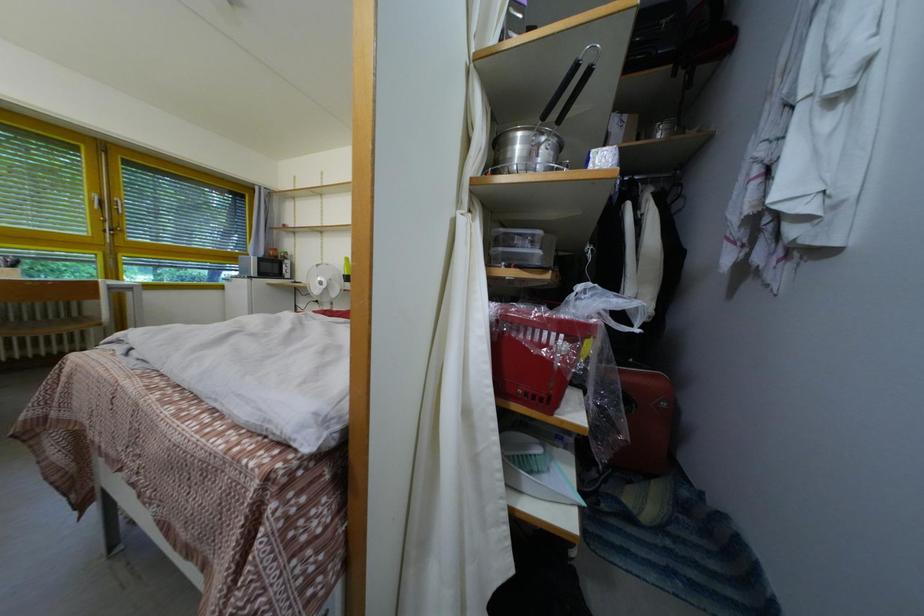
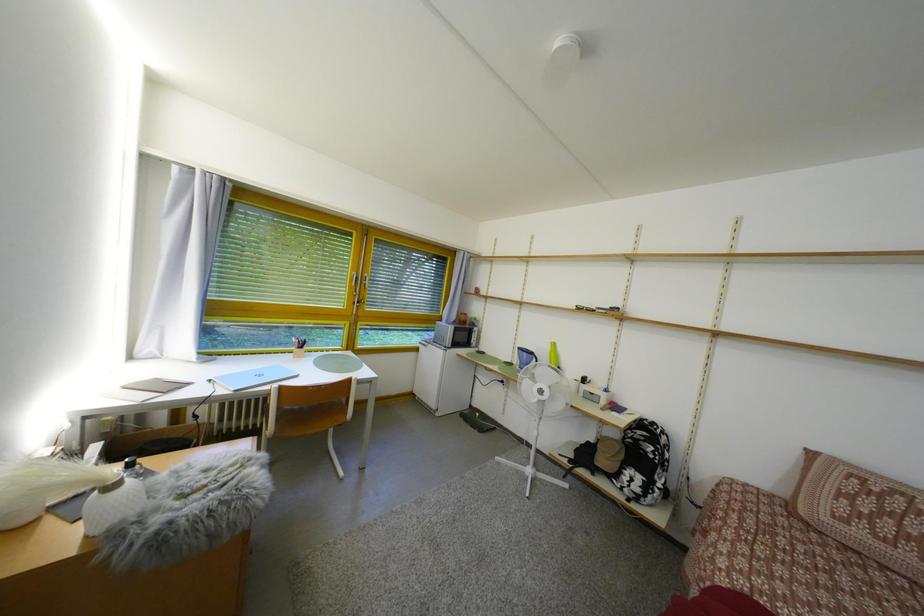
What movement of the cameraman would produce the second image?

The cameraman moved toward left, forward.